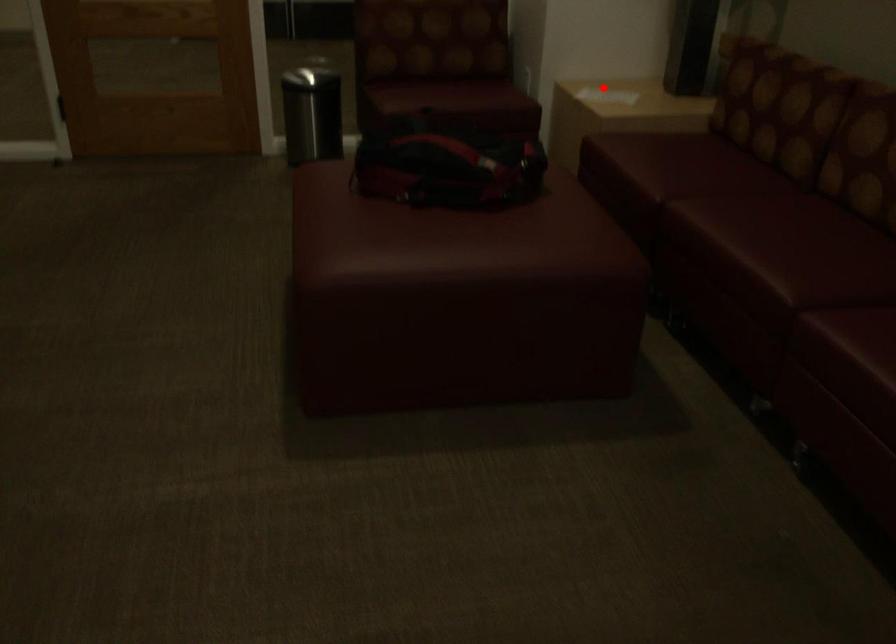
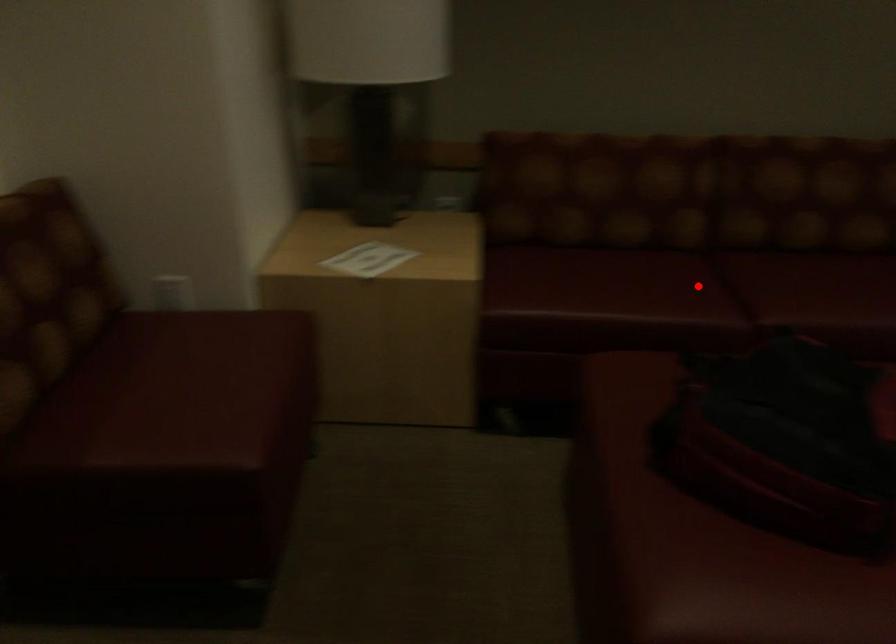
I am providing you with two images of the same scene from different viewpoints. A red point is marked on the first image and another point is marked on the second image. Is the marked point in image1 the same physical position as the marked point in image2?

No